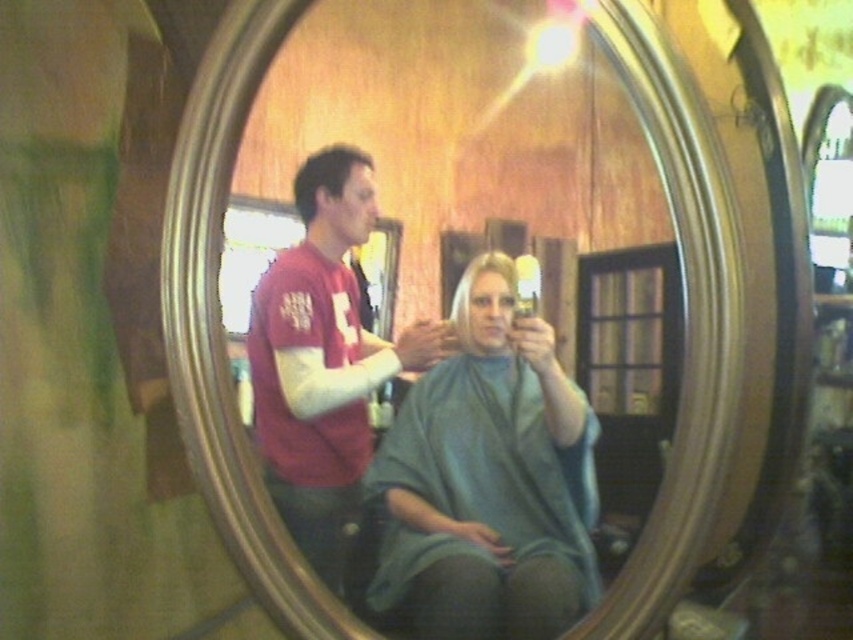
You are a customer in a barbershop and want to check your new hairstyle in the mirror. The green fabric cape at center is covering part of your view. Can you move the cape to the left to see your blonde hair at center better?

The green fabric cape at center is to the right of blonde hair at center, so moving it to the left would allow you to see the blonde hair at center better.

You are a customer in a barbershop and want to check your reflection in the silver metallic mirror at center while looking at your blonde hair at center. Which object is closer to you?

The silver metallic mirror at center is closer to you than the blonde hair at center because it is further to the viewer.

You are a customer in a barbershop and want to see your new hairstyle in the mirror. The barber is standing in front of you wearing a matte red shirt at center. Where would you look to see your blonde hair at center reflected in the mirror?

The blonde hair at center is behind the matte red shirt at center, so when looking in the mirror, you would see the matte red shirt at center in front of your blonde hair at center. To see your own blonde hair at center reflected, you would need to adjust your position so that the mirror reflects the area behind the barber, where your hair is located.